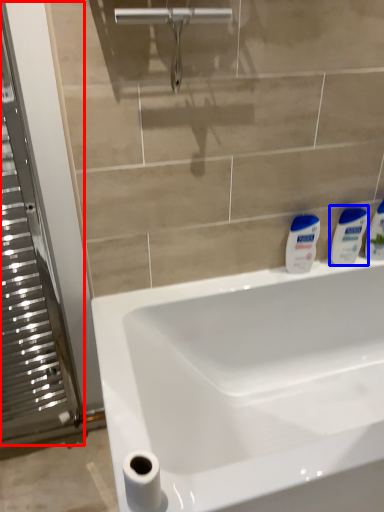
Question: Which object appears closest to the camera in this image, screen door (highlighted by a red box) or toiletry (highlighted by a blue box)?

Choices:
 (A) screen door
 (B) toiletry

Answer: (A)